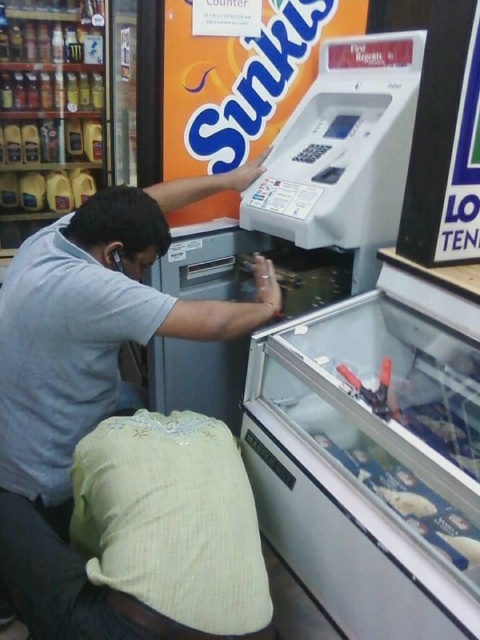
Does white plastic vending machine at lower right come in front of light blue shirt at center?

Yes, white plastic vending machine at lower right is in front of light blue shirt at center.

Who is more distant from viewer, (436, 362) or (128, 292)?

Positioned behind is point (128, 292).

Locate an element on the screen. The image size is (480, 640). white plastic vending machine at lower right is located at coordinates 371,467.